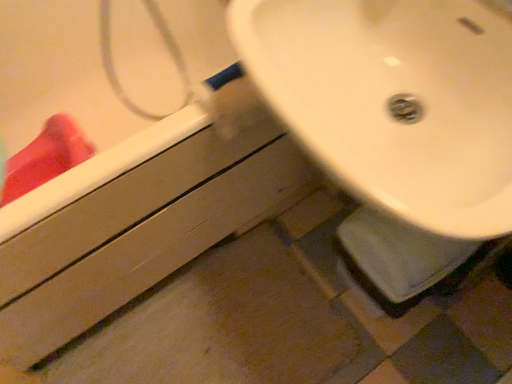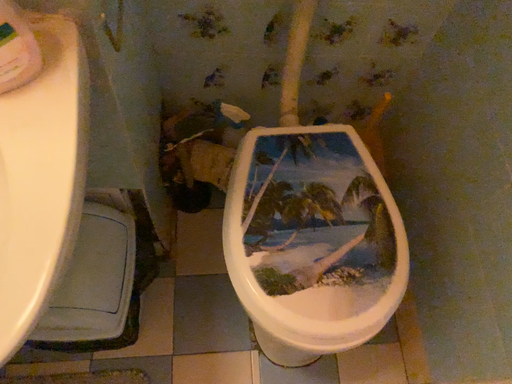
Question: Which way did the camera rotate in the video?

Choices:
 (A) rotated downward
 (B) rotated upward

Answer: (B)